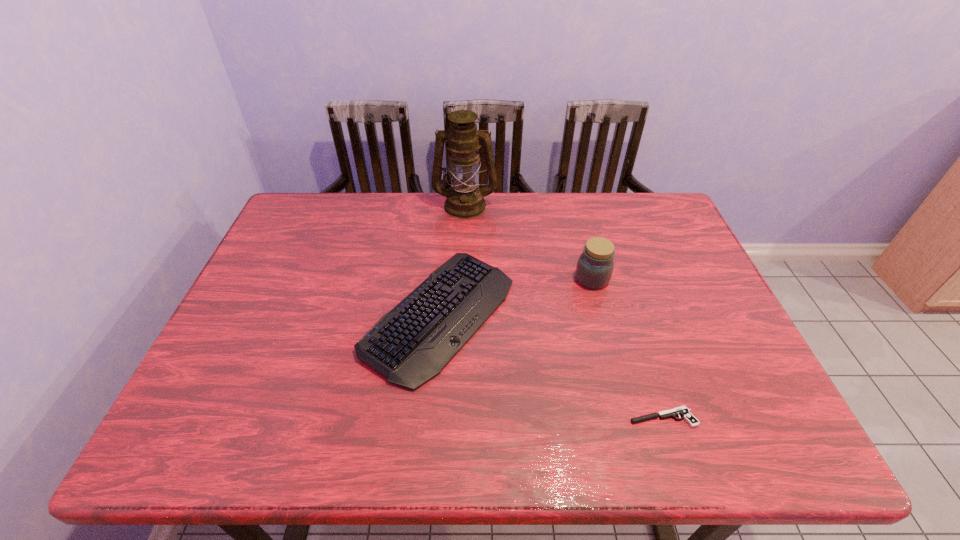
Identify the location of empty space between the tallest object and the shortest object. (564, 312).

This screenshot has height=540, width=960. I want to click on free space between the shortest object and the third tallest object, so click(551, 367).

Locate an element on the screen. The height and width of the screenshot is (540, 960). free spot between the second shortest object and the third shortest object is located at coordinates (516, 297).

Find the location of a particular element. The image size is (960, 540). free area in between the nearest object and the third tallest object is located at coordinates (551, 367).

What are the coordinates of `free space between the oil lamp and the shortest object` in the screenshot? It's located at (564, 312).

This screenshot has width=960, height=540. Identify the location of vacant space that's between the jar and the tallest object. (529, 242).

Where is `free space between the shortest object and the tallest object`? This screenshot has height=540, width=960. free space between the shortest object and the tallest object is located at coordinates (564, 312).

This screenshot has height=540, width=960. Find the location of `free space that is in between the second shortest object and the pistol`. free space that is in between the second shortest object and the pistol is located at coordinates (551, 367).

What are the coordinates of `object that stands as the closest to the computer keyboard` in the screenshot? It's located at (x=595, y=265).

Identify the location of object that stands as the closest to the third shortest object. This screenshot has width=960, height=540. (411, 344).